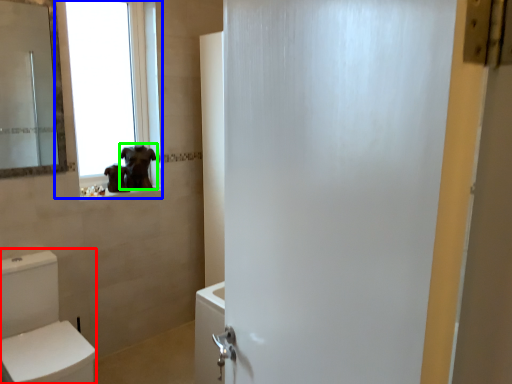
Question: Which is nearer to the toilet bowl (highlighted by a red box)? window (highlighted by a blue box) or animal (highlighted by a green box).

Choices:
 (A) window
 (B) animal

Answer: (B)